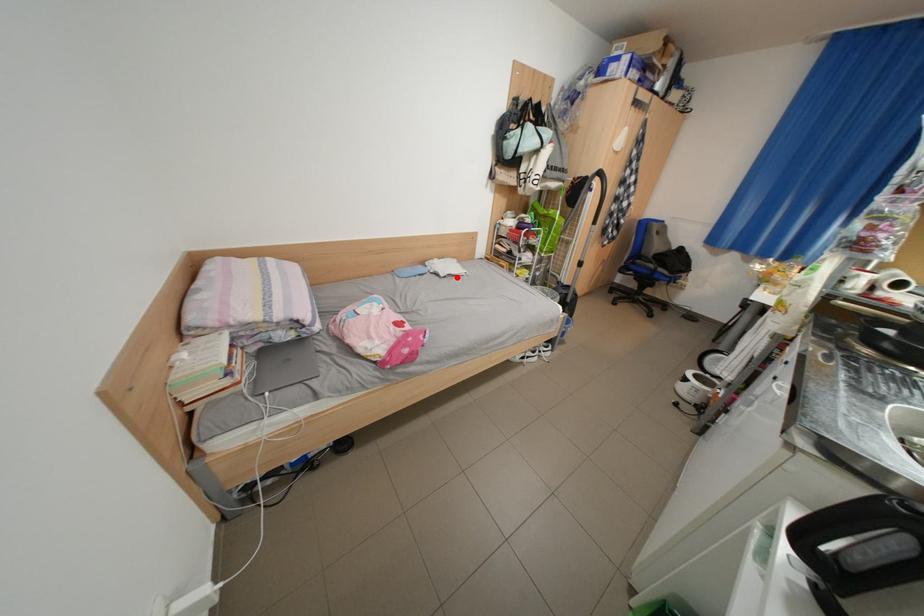
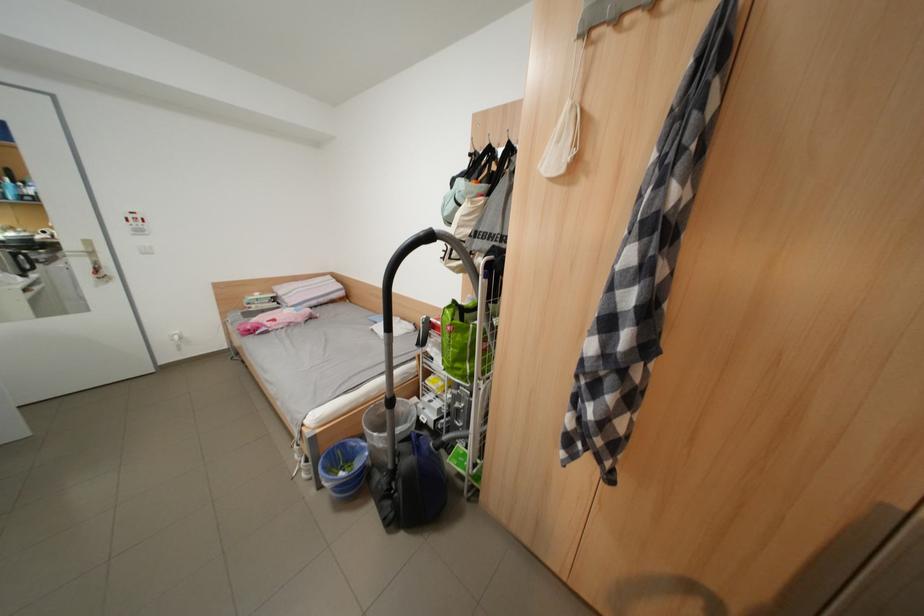
Question: I am providing you with two images of the same scene from different viewpoints. In image1, a red point is highlighted. Considering the same 3D point in image2, which of the following is correct?

Choices:
 (A) It is closer
 (B) It is farther

Answer: (B)